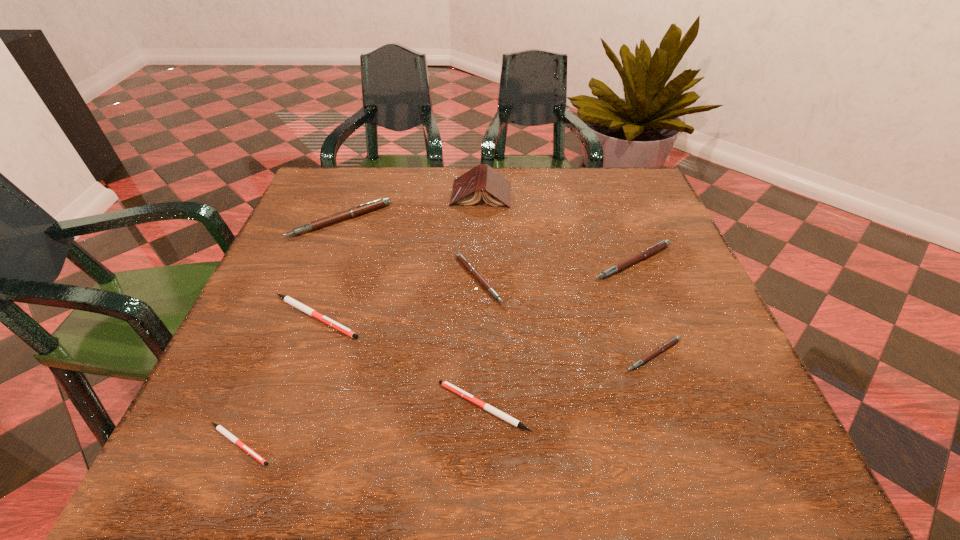
The width and height of the screenshot is (960, 540). Identify the location of vacant space that satisfies the following two spatial constraints: 1. at the nib of the nearest pink pen; 2. on the clicker of the shortest pen. (684, 444).

You are a GUI agent. You are given a task and a screenshot of the screen. Output one action in this format:
    pyautogui.click(x=<x>, y=<y>)
    Task: Click on the vacant area in the image that satisfies the following two spatial constraints: 1. at the nib of the smallest pink pen; 2. on the clicker of the shortest pen
    The image size is (960, 540).
    Given the screenshot: What is the action you would take?
    pyautogui.click(x=684, y=444)

Identify the location of vacant space that satisfies the following two spatial constraints: 1. at the nib of the third smallest pink pen; 2. on the clicker of the farthest white pen. The height and width of the screenshot is (540, 960). (653, 316).

Identify the location of vacant area in the image that satisfies the following two spatial constraints: 1. at the nib of the second biggest pink pen; 2. on the clicker of the biggest white pen. Image resolution: width=960 pixels, height=540 pixels. (653, 316).

This screenshot has height=540, width=960. Identify the location of free spot that satisfies the following two spatial constraints: 1. at the nib of the nearest pink pen; 2. on the clicker of the shortest object. (684, 444).